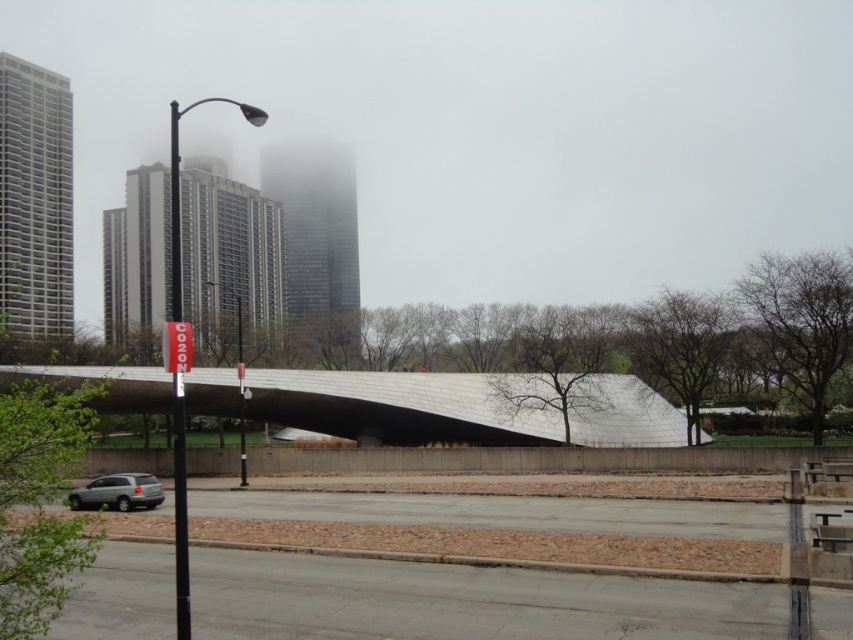
You are driving a car and want to park near the silver metallic overpass at center. The parking spot is located to the right of the silver metallic suv at lower left. Can you park there without crossing the overpass?

The silver metallic overpass at center is to the right of the silver metallic suv at lower left, so the parking spot to the right of the silver metallic suv at lower left would be under or near the overpass. Since the overpass is a structure above, you can park there without crossing it as long as the parking spot is accessible on the ground level.

You are standing at the origin point of the city map. You need to locate the silver metallic overpass at center. What are its coordinates?

The silver metallic overpass at center is located at coordinates point (x=401, y=406).

You are a delivery driver who needs to pass under the silver metallic overpass at center with your truck that is 3 meters tall. Can you safely drive under the overpass while avoiding the silver metallic suv at lower left?

The silver metallic overpass at center is taller than the silver metallic suv at lower left, but the height of the overpass itself isn not specified. Without knowing the exact height of the overpass, it is impossible to determine if the truck can safely pass under it.